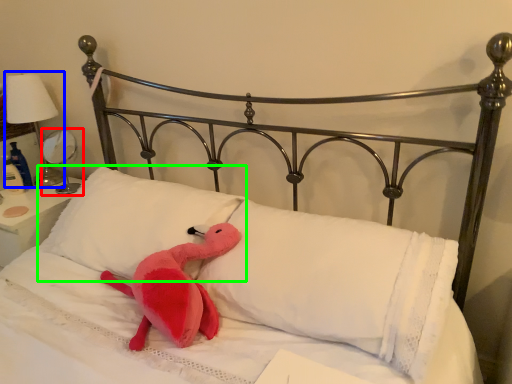
Question: Based on their relative distances, which object is farther from table lamp (highlighted by a red box)? Choose from table lamp (highlighted by a blue box) and pillow (highlighted by a green box).

Choices:
 (A) table lamp
 (B) pillow

Answer: (B)